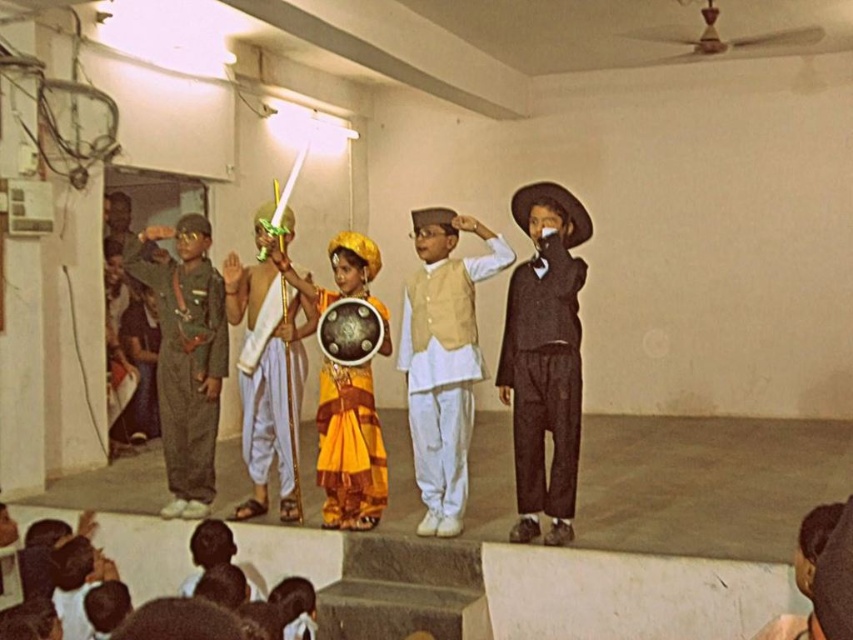
You are an audience member sitting in the front row of the stage. You want to know which of the two performers, the dark brown woolen suit at right or the white cotton kurta at center, is standing closer to you. Can you determine this based on the stage setup?

The dark brown woolen suit at right is closer to the viewer than the white cotton kurta at center, so the dark brown woolen suit at right is standing closer to you.

You are a stagehand measuring the space between the green fabric uniform at left and the white silk dhoti at center. The minimum required distance for safe passage is 12 inches. Is the current distance sufficient?

The distance between the green fabric uniform at left and the white silk dhoti at center is 13.46 inches, which exceeds the minimum required 12 inches for safe passage. Therefore, the current distance is sufficient.

You are organizing a photo shoot for a magazine and need to arrange the dark brown woolen suit at right and the white silk dhoti at center in a row. Given their sizes, which one should be placed first to ensure they fit within the 2.5 meter space allocated?

The white silk dhoti at center is narrower than the dark brown woolen suit at right. To fit within the 2.5 meter space, place the wider dark brown woolen suit at right first, followed by the narrower white silk dhoti at center.